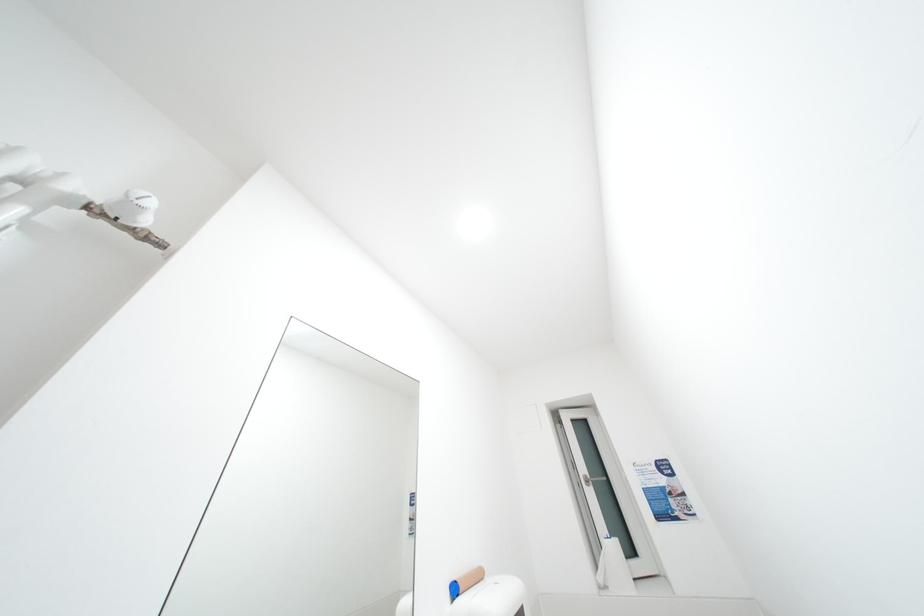
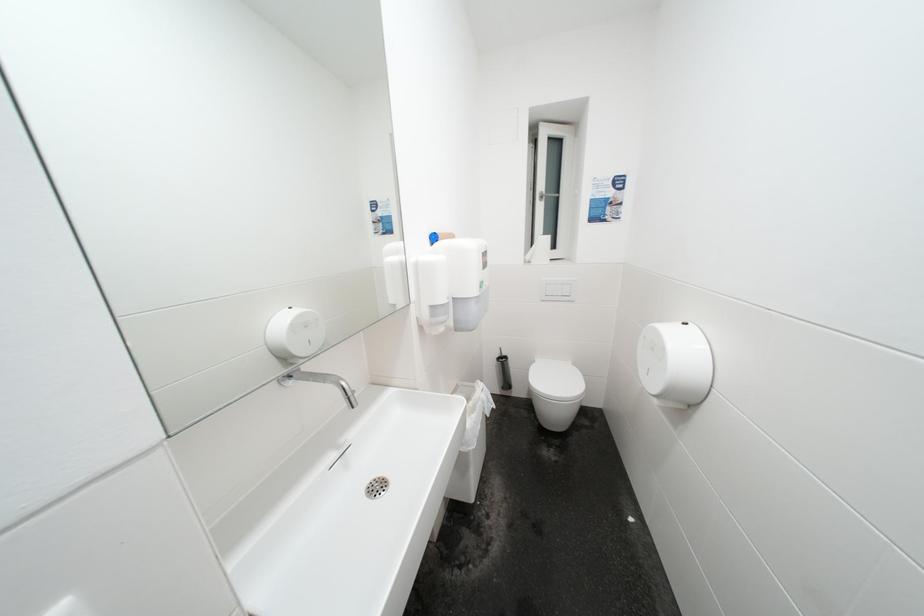
Based on the continuous images, in which direction is the camera rotating?

The rotation direction of the camera is right-down.